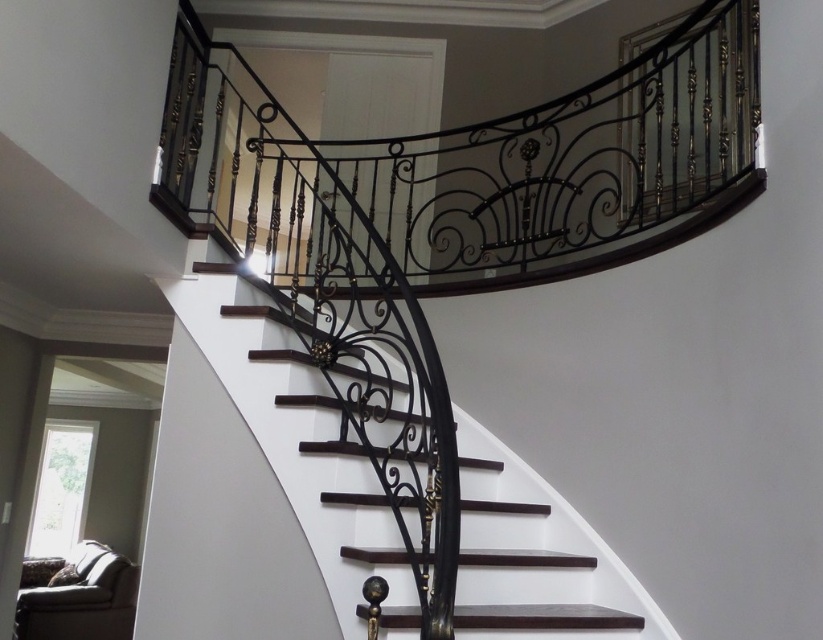
You are an interior designer assessing the space between the black wrought iron balustrade at upper center and the dark wood stairs at center for installing a decorative light fixture. Based on their heights, can you determine which one is shorter?

The black wrought iron balustrade at upper center is not as tall as dark wood stairs at center, so the black wrought iron balustrade at upper center is shorter.

You are an interior designer assessing the space between the black wrought iron balustrade at upper center and the dark wood stairs at center. Can you determine if the balustrade is larger in size compared to the stairs?

The black wrought iron balustrade at upper center is bigger than dark wood stairs at center, so yes, the balustrade is larger in size compared to the stairs.

You are standing at the base of the spiral staircase and want to climb up to the landing. As you look up, which object is closer to you between the dark wood stairs at center and the black wrought iron balustrade at upper center?

The black wrought iron balustrade at upper center is closer to you because the dark wood stairs at center is behind it.